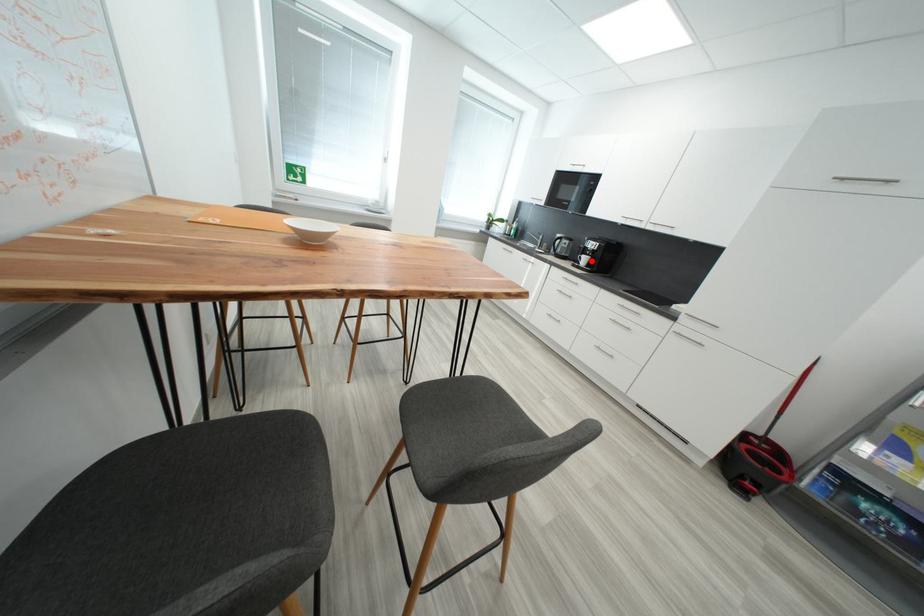
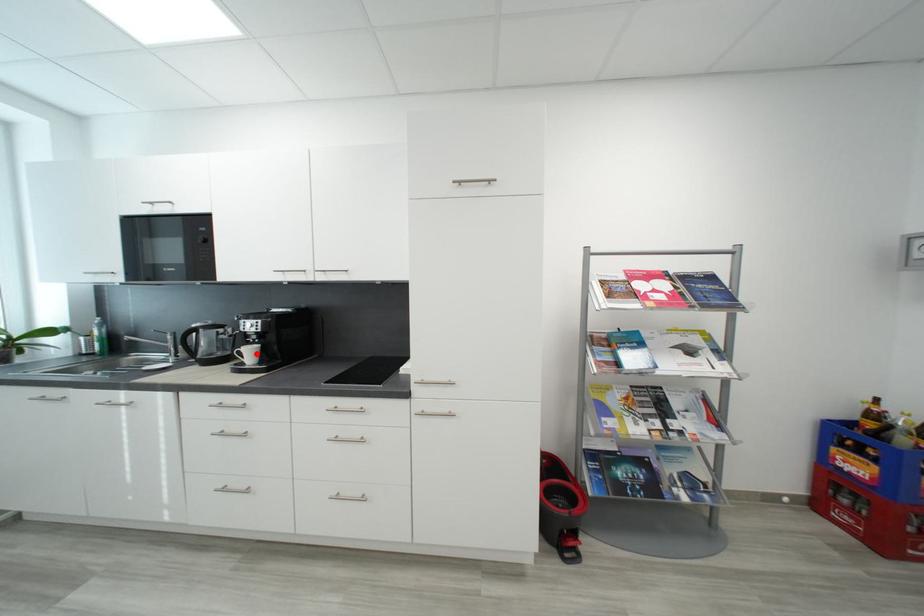
I am providing you with two images of the same scene from different viewpoints. A red point is marked on the first image and another point is marked on the second image. Is the red point in image1 aligned with the point shown in image2?

Yes